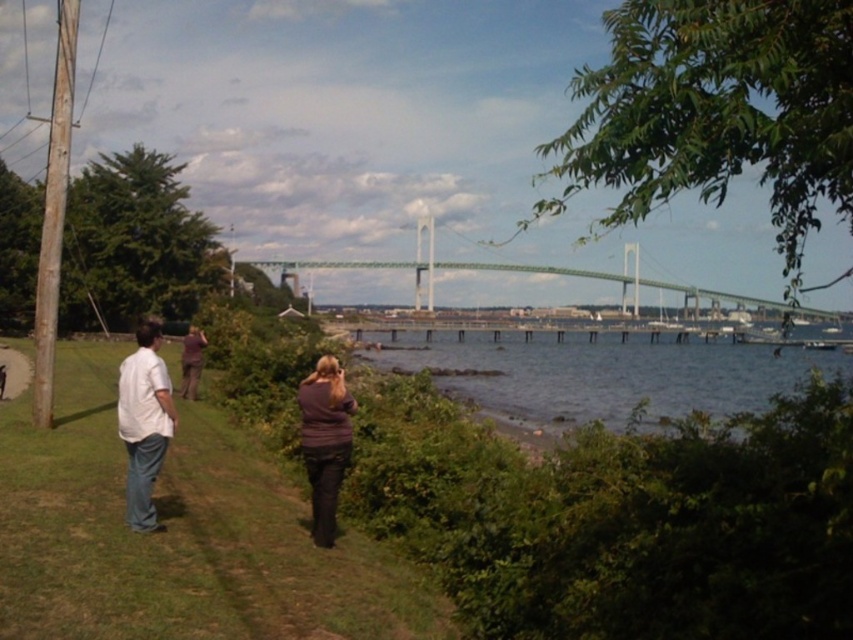
Can you confirm if green water at lower center is positioned below green metallic bridge at center?

Yes.

Does green water at lower center have a greater height compared to green metallic bridge at center?

No.

Who is more distant from viewer, (569, 349) or (415, 273)?

The point (415, 273) is more distant.

You are a GUI agent. You are given a task and a screenshot of the screen. Output one action in this format:
    pyautogui.click(x=<x>, y=<y>)
    Task: Click on the green water at lower center
    
    Given the screenshot: What is the action you would take?
    pyautogui.click(x=598, y=372)

Can you confirm if white matte shirt at left is shorter than dark purple sweater at center?

No, white matte shirt at left is not shorter than dark purple sweater at center.

Which is below, white matte shirt at left or dark purple sweater at center?

Positioned lower is white matte shirt at left.

Who is more forward, (165, 394) or (317, 536)?

Point (165, 394) is in front.

The height and width of the screenshot is (640, 853). I want to click on white matte shirt at left, so click(x=144, y=422).

Can you confirm if dark purple sweater at center is bigger than green metallic bridge at center?

Incorrect, dark purple sweater at center is not larger than green metallic bridge at center.

Can you confirm if dark purple sweater at center is wider than green metallic bridge at center?

In fact, dark purple sweater at center might be narrower than green metallic bridge at center.

Describe the element at coordinates (323, 442) in the screenshot. The width and height of the screenshot is (853, 640). I see `dark purple sweater at center` at that location.

The image size is (853, 640). Identify the location of dark purple sweater at center. [323, 442].